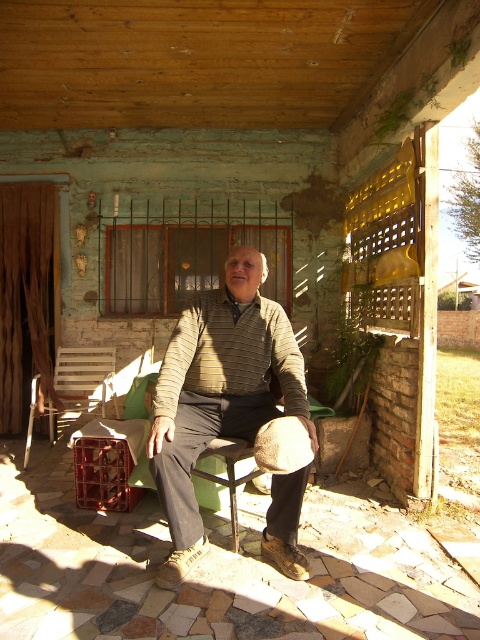
Does striped knit sweater at center lie in front of wooden slats chair at left?

Yes, it is.

Is striped knit sweater at center wider than wooden slats chair at left?

Yes, striped knit sweater at center is wider than wooden slats chair at left.

Is point (189, 554) more distant than point (104, 371)?

No, it is in front of (104, 371).

This screenshot has height=640, width=480. I want to click on striped knit sweater at center, so click(218, 392).